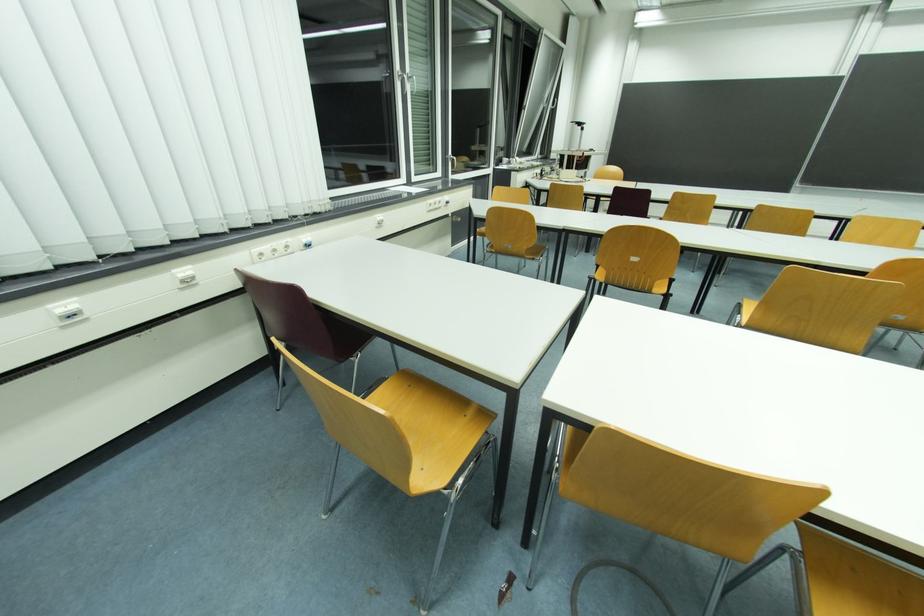
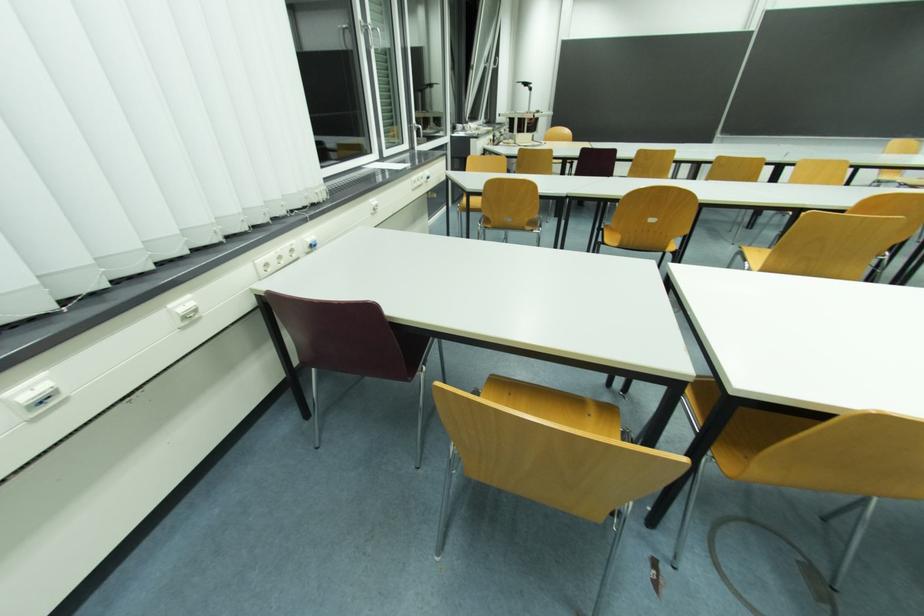
Question: The camera is either moving clockwise (left) or counter-clockwise (right) around the object. The first image is from the beginning of the video and the second image is from the end. Is the camera moving left or right when shooting the video?

Choices:
 (A) Left
 (B) Right

Answer: (A)